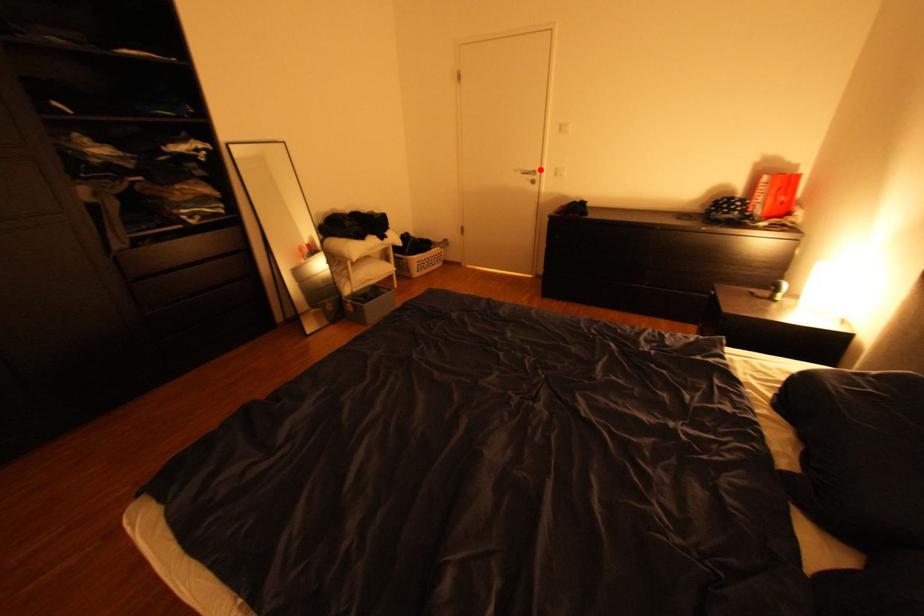
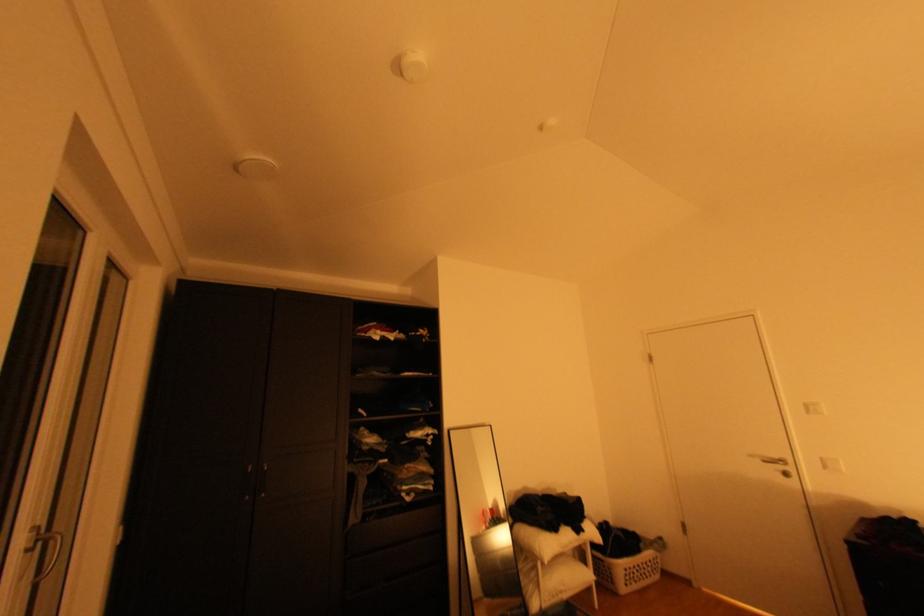
Question: I am providing you with two images of the same scene from different viewpoints. In image1, a red point is highlighted. Considering the same 3D point in image2, which of the following is correct?

Choices:
 (A) It is closer
 (B) It is farther

Answer: (B)